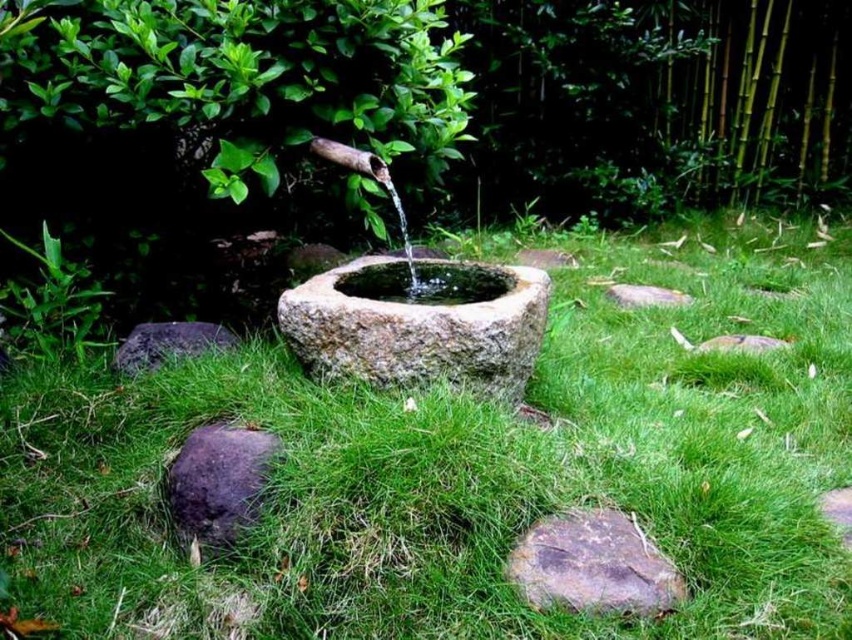
Question: Is dark gray rock at lower left above gray stone at lower right?

Choices:
 (A) no
 (B) yes

Answer: (B)

Question: Is gray stone at lower right behind smooth gray stone at center?

Choices:
 (A) no
 (B) yes

Answer: (A)

Question: Can you confirm if brown rough rock at lower center is wider than dark gray rock at lower left?

Choices:
 (A) yes
 (B) no

Answer: (A)

Question: Among these objects, which one is nearest to the camera?

Choices:
 (A) smooth gray stone at center
 (B) green grass at center
 (C) brown rough rock at lower left

Answer: (B)

Question: Which of these objects is positioned closest to the smooth gray rock at center-right?

Choices:
 (A) gray stone at lower right
 (B) brown rough rock at lower center
 (C) green grass at center
 (D) brown rough rock at lower left

Answer: (A)

Question: Among these points, which one is farthest from the camera?

Choices:
 (A) (787, 227)
 (B) (597, 509)
 (C) (179, 324)

Answer: (A)